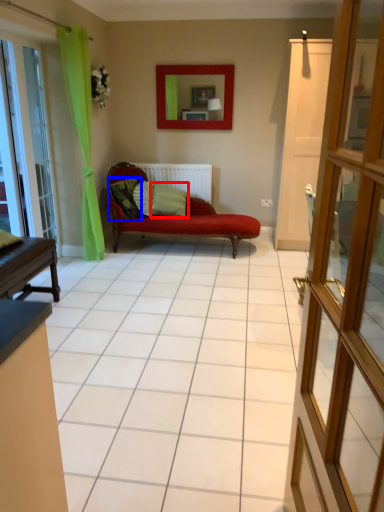
Question: Which object is closer to the camera taking this photo, pillow (highlighted by a red box) or pillow (highlighted by a blue box)?

Choices:
 (A) pillow
 (B) pillow

Answer: (B)